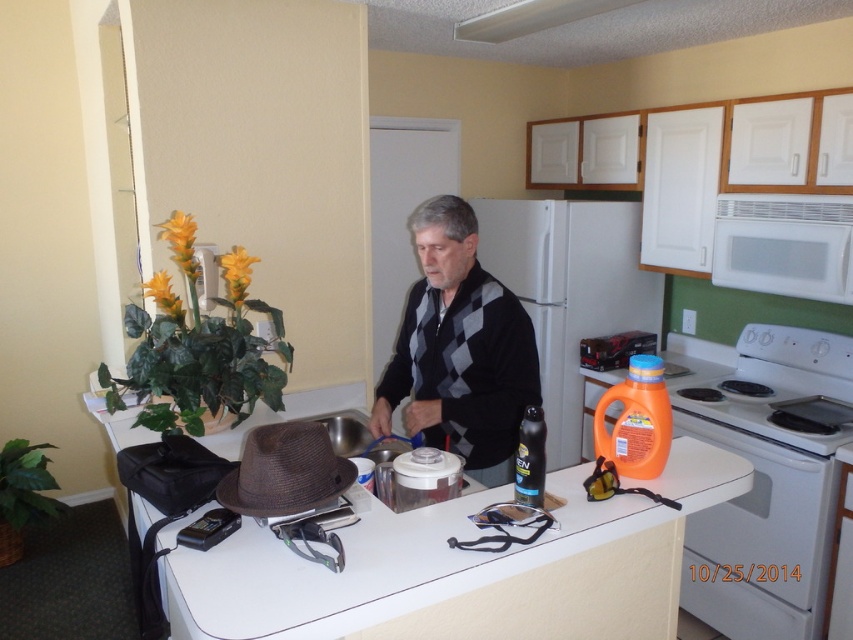
You are a delivery person who needs to place a 2.5 meter long ladder in the kitchen. The ladder must be placed between the orange plastic detergent at center and the brown straw hat at center. Is there enough space between them to fit the ladder?

The distance between the orange plastic detergent at center and the brown straw hat at center is 1.95 meters. Since the ladder is 2.5 meters long, it is longer than the available space. Therefore, the ladder cannot be placed between them.

Looking at this image, you are in the kitchen and want to reach both points. Which point, point (242,452) or point (467,35), is closer to you?

Point (242,452) is closer to the viewer than point (467,35).

You are organizing the kitchen and need to place a new item on the counter. The new item requires a spot that is not occupied by the orange plastic detergent at right. Where should you place it?

The orange plastic detergent at right is located at point (764, 483). You should place the new item in an area of the counter not at that coordinate.